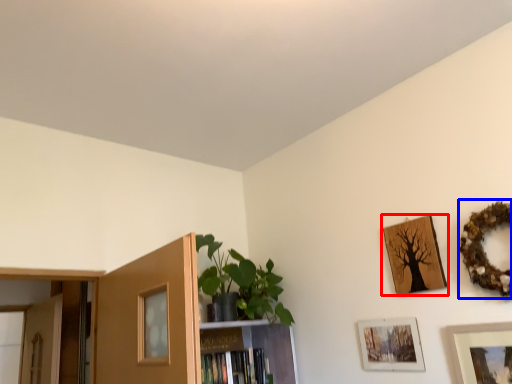
Question: Which point is further to the camera, picture frame (highlighted by a red box) or picture frame (highlighted by a blue box)?

Choices:
 (A) picture frame
 (B) picture frame

Answer: (A)